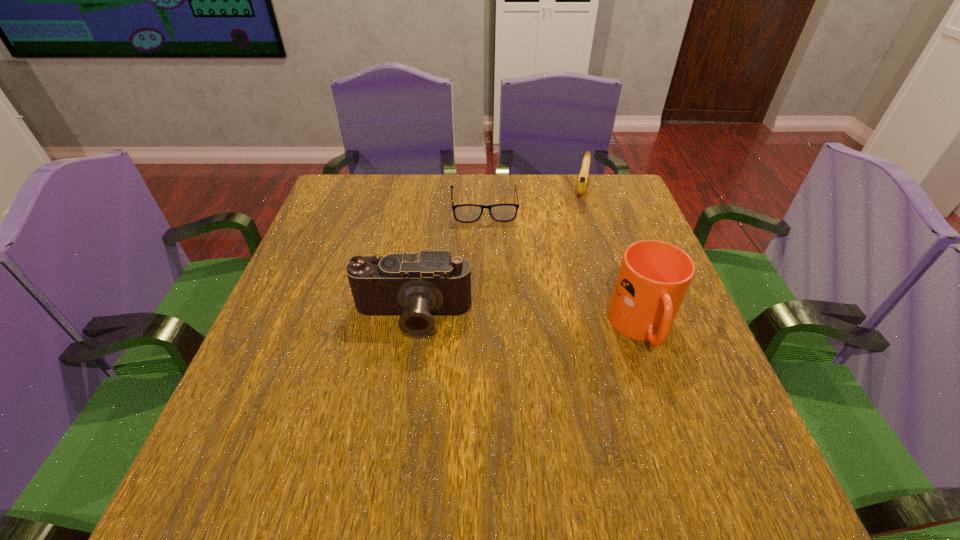
Find the location of a particular element. The height and width of the screenshot is (540, 960). camera is located at coordinates (x=416, y=286).

Identify the location of mug. (654, 276).

Where is `banana`? The image size is (960, 540). banana is located at coordinates (584, 171).

Locate an element on the screen. The image size is (960, 540). spectacles is located at coordinates (466, 213).

This screenshot has width=960, height=540. What are the coordinates of `free region located on the front-facing side of the camera` in the screenshot? It's located at (399, 397).

You are a GUI agent. You are given a task and a screenshot of the screen. Output one action in this format:
    pyautogui.click(x=<x>, y=<y>)
    Task: Click on the vacant space located on the handle side of the tallest object
    The width and height of the screenshot is (960, 540).
    Given the screenshot: What is the action you would take?
    pyautogui.click(x=667, y=399)

Where is `vacant space situated 0.170m at the stem of the third tallest object`? This screenshot has height=540, width=960. vacant space situated 0.170m at the stem of the third tallest object is located at coordinates (578, 242).

This screenshot has width=960, height=540. I want to click on vacant space located 0.120m at the stem of the third tallest object, so click(580, 231).

You are a GUI agent. You are given a task and a screenshot of the screen. Output one action in this format:
    pyautogui.click(x=<x>, y=<y>)
    Task: Click on the free space located at the stem of the third tallest object
    The image size is (960, 540).
    Given the screenshot: What is the action you would take?
    pyautogui.click(x=579, y=235)

Where is `vacant space located on the front-facing side of the spectacles`? vacant space located on the front-facing side of the spectacles is located at coordinates (495, 322).